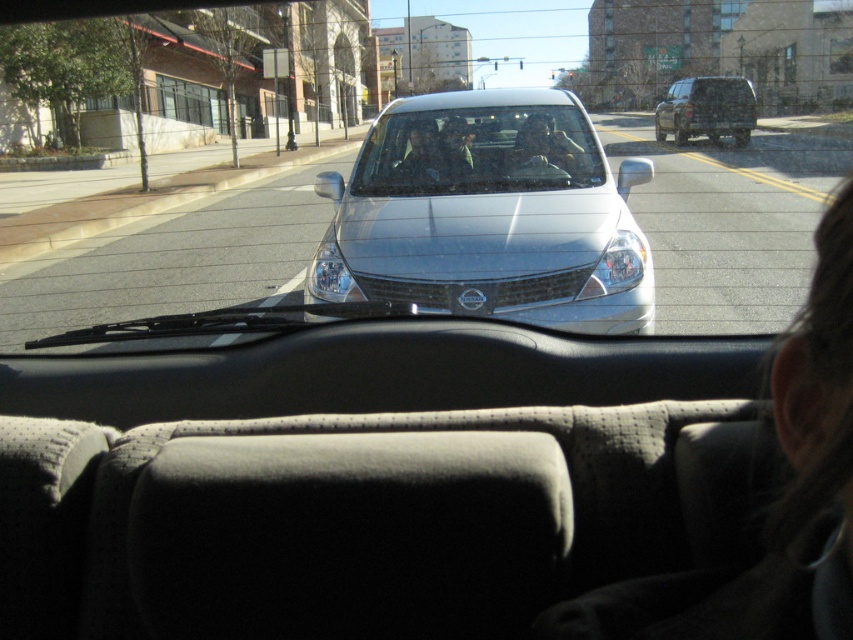
You are sitting in the passenger seat of a car and looking out through the windshield. There is a point at coordinates (477, 150). Based on the scene description, where is this point located?

The point at coordinates (477, 150) is on the clear glass windshield at center.

You are sitting in the passenger seat of a car and looking out the windshield. You see two points marked in the scene. Based on your perspective, which point is closer to you, point at coordinates (616, 285) or point at coordinates (717, 81)?

Point at coordinates (616, 285) is closer to you than point at coordinates (717, 81).